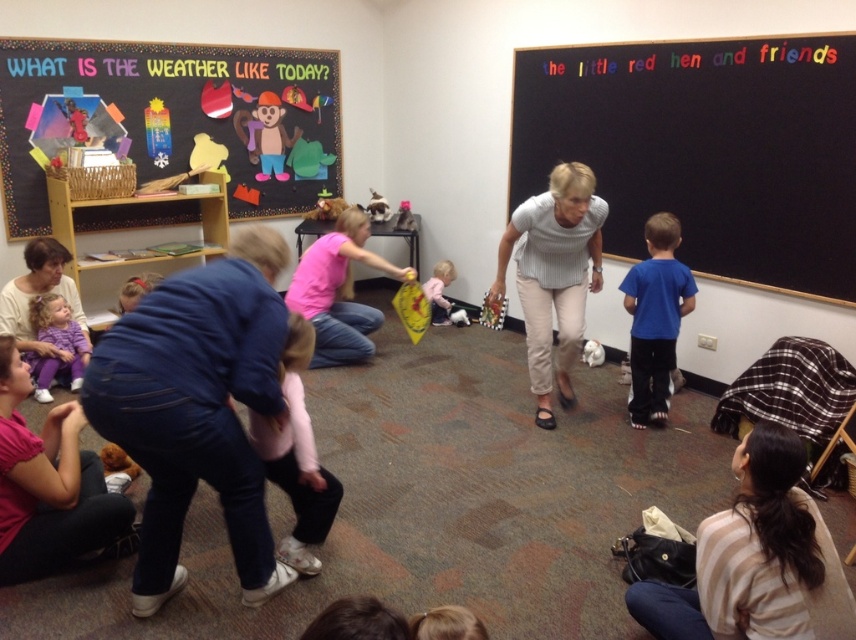
You are a student in the classroom and need to decide which item to take first. The pink fleece jacket at center and the purple fleece pants at lower left are both on the floor. Which one is narrower?

The pink fleece jacket at center is narrower than the purple fleece pants at lower left because its width is less than the other.

You are a photographer in the classroom trying to capture a clear shot of both the pink fabric shirt at center and the blue matte shirt at center. Which one is closer to the camera?

The pink fabric shirt at center is closer to the camera than the blue matte shirt at center because it is further to the viewer.

You are a photographer in the classroom and want to capture both the pink fabric shirt at center and the blue matte shirt at center in a single shot. Which shirt should you focus on first to ensure both are in frame?

The pink fabric shirt at center is larger in size compared to the blue matte shirt at center, so focusing on the pink fabric shirt at center first will help ensure both are in frame as it occupies more space.